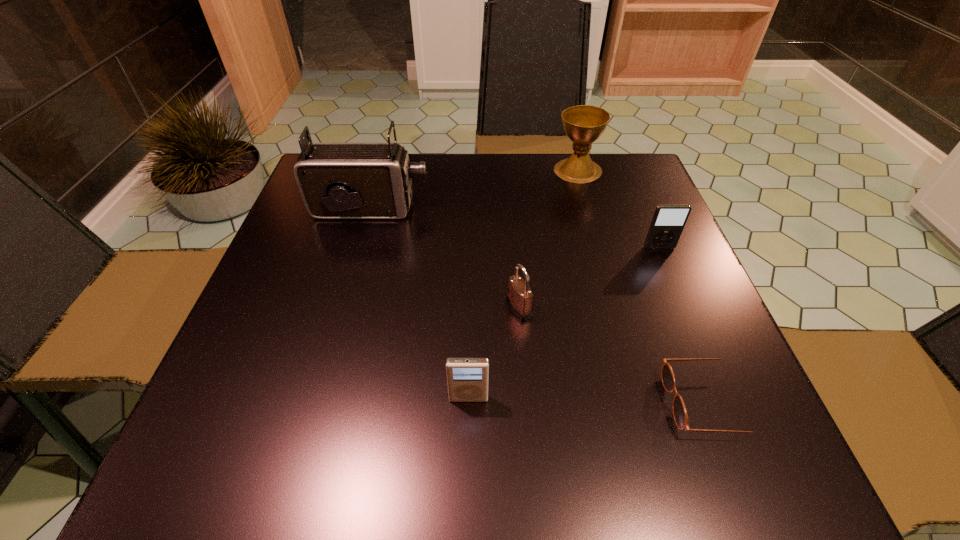
I want to click on chalice that is at the far edge, so click(584, 124).

This screenshot has height=540, width=960. Identify the location of object that is positioned at the near edge. (680, 416).

Where is `object that is at the left edge`? object that is at the left edge is located at coordinates (336, 180).

Where is `chalice situated at the right edge`? This screenshot has width=960, height=540. chalice situated at the right edge is located at coordinates coord(584,124).

The image size is (960, 540). In order to click on iPod that is at the right edge in this screenshot , I will do `click(668, 222)`.

Locate an element on the screen. sunglasses located in the right edge section of the desktop is located at coordinates (680, 416).

Locate an element on the screen. object at the far left corner is located at coordinates (336, 180).

The height and width of the screenshot is (540, 960). Identify the location of object that is at the far right corner. (584, 124).

The image size is (960, 540). Find the location of `object that is at the near right corner`. object that is at the near right corner is located at coordinates (680, 416).

The height and width of the screenshot is (540, 960). Identify the location of vacant space at the far edge of the desktop. (563, 206).